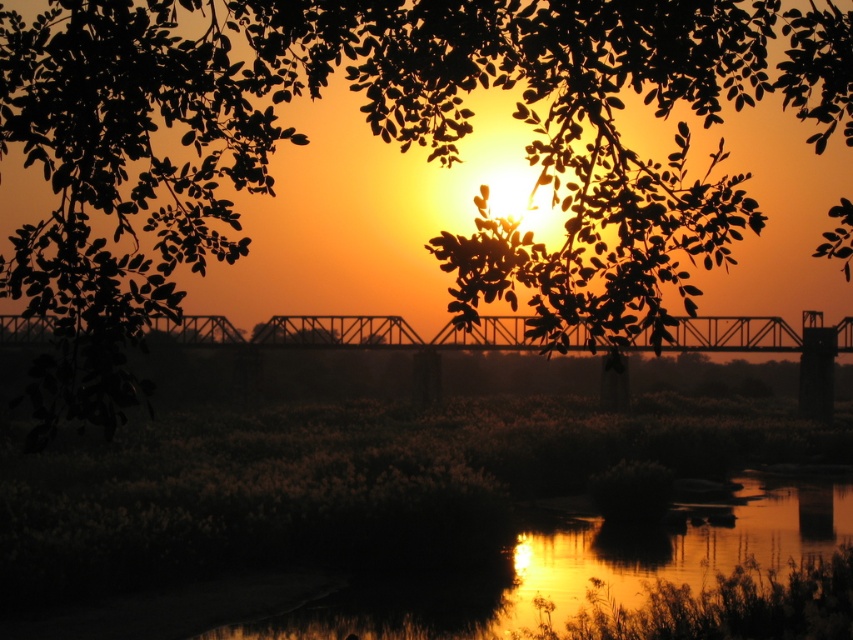
Does shiny reflective water at center have a lesser width compared to metallic bridge at center?

Indeed, shiny reflective water at center has a lesser width compared to metallic bridge at center.

Is shiny reflective water at center shorter than metallic bridge at center?

Yes, shiny reflective water at center is shorter than metallic bridge at center.

Between point (334, 637) and point (479, 340), which one is positioned in front?

Point (334, 637)

In order to click on shiny reflective water at center in this screenshot , I will do `click(589, 566)`.

Can you confirm if green leafy tree at upper center is positioned to the left of shiny reflective water at center?

Yes, green leafy tree at upper center is to the left of shiny reflective water at center.

Who is more distant from viewer, (425, 76) or (616, 582)?

The point (616, 582) is more distant.

Does point (219, 29) come in front of point (671, 548)?

Yes.

This screenshot has height=640, width=853. I want to click on green leafy tree at upper center, so click(x=395, y=140).

Which of these two, green leafy tree at upper center or metallic bridge at center, stands taller?

green leafy tree at upper center

Between green leafy tree at upper center and metallic bridge at center, which one appears on the left side from the viewer's perspective?

Positioned to the left is green leafy tree at upper center.

Between point (636, 196) and point (190, 326), which one is positioned in front?

Point (636, 196)

You are a GUI agent. You are given a task and a screenshot of the screen. Output one action in this format:
    pyautogui.click(x=<x>, y=<y>)
    Task: Click on the green leafy tree at upper center
    
    Given the screenshot: What is the action you would take?
    pyautogui.click(x=395, y=140)